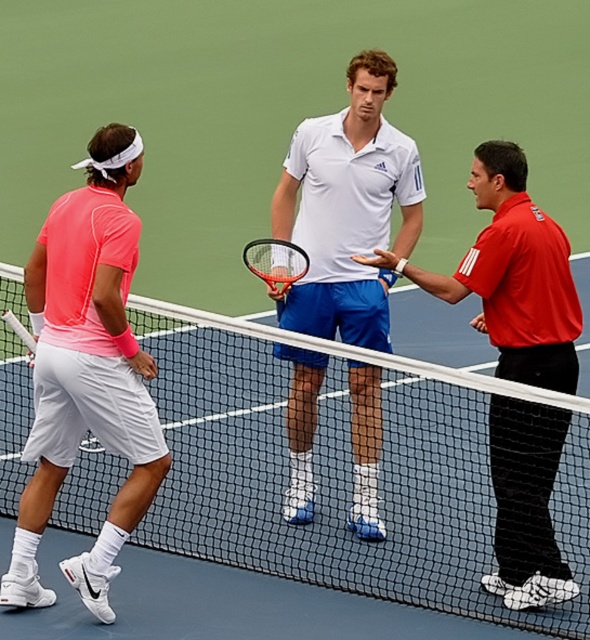
Is black mesh tennis net at center below white matte tennis racket at center?

Correct, black mesh tennis net at center is located below white matte tennis racket at center.

Consider the image. Can you confirm if black mesh tennis net at center is positioned above white matte tennis racket at center?

No, black mesh tennis net at center is not above white matte tennis racket at center.

What do you see at coordinates (345, 470) in the screenshot? I see `black mesh tennis net at center` at bounding box center [345, 470].

Find the location of `black mesh tennis net at center`. black mesh tennis net at center is located at coordinates (345, 470).

What do you see at coordinates (345, 470) in the screenshot? I see `black mesh tennis net at center` at bounding box center [345, 470].

Between point (18, 275) and point (45, 284), which one is positioned behind?

Positioned behind is point (18, 275).

You are a GUI agent. You are given a task and a screenshot of the screen. Output one action in this format:
    pyautogui.click(x=<x>, y=<y>)
    Task: Click on the black mesh tennis net at center
    
    Given the screenshot: What is the action you would take?
    pyautogui.click(x=345, y=470)

How distant is orange matte tennis racket at center from matte black tennis racket at left?

orange matte tennis racket at center and matte black tennis racket at left are 1.53 meters apart.

Does orange matte tennis racket at center appear on the left side of matte black tennis racket at left?

In fact, orange matte tennis racket at center is to the right of matte black tennis racket at left.

The height and width of the screenshot is (640, 590). Identify the location of orange matte tennis racket at center. (276, 262).

The image size is (590, 640). What are the coordinates of `orange matte tennis racket at center` in the screenshot? It's located at (276, 262).